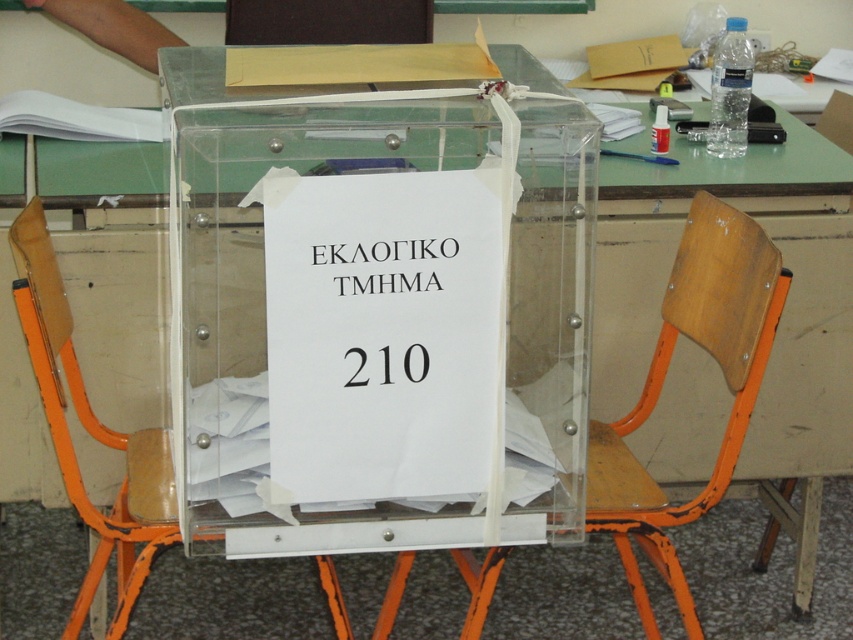
Question: Among these points, which one is nearest to the camera?

Choices:
 (A) (369, 275)
 (B) (424, 289)
 (C) (338, 636)
 (D) (694, 218)

Answer: (A)

Question: Does orange plastic chair at center appear on the right side of white paper at center?

Choices:
 (A) no
 (B) yes

Answer: (A)

Question: Considering the real-world distances, which object is closest to the wooden at center?

Choices:
 (A) orange plastic chair at center
 (B) white paper at center

Answer: (A)

Question: Is orange plastic chair at center to the right of white paper at center from the viewer's perspective?

Choices:
 (A) yes
 (B) no

Answer: (B)

Question: Which object is positioned farthest from the white paper at center?

Choices:
 (A) wooden at center
 (B) orange plastic chair at center

Answer: (A)

Question: From the image, what is the correct spatial relationship of wooden at center in relation to orange plastic chair at center?

Choices:
 (A) below
 (B) above

Answer: (B)